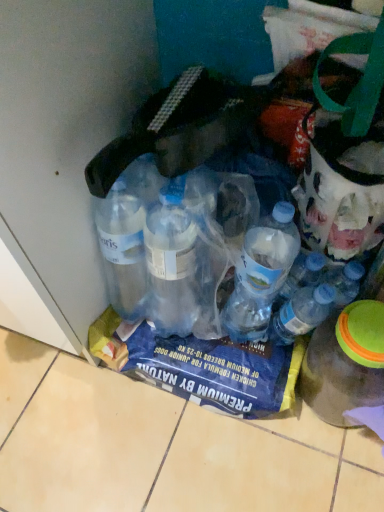
Question: Which direction should I rotate to look at translucent plastic bottle at center, placed as the 2th bottle when sorted from left to right, — up or down?

Choices:
 (A) up
 (B) down

Answer: (B)

Question: Is transparent plastic bottle at lower right, which is the 1th bottle from right to left, thinner than translucent plastic bottle at center, which is counted as the second bottle, starting from the right?

Choices:
 (A) yes
 (B) no

Answer: (B)

Question: From a real-world perspective, is transparent plastic bottle at lower right, which is the 1th bottle from right to left, over translucent plastic bottle at center, placed as the 2th bottle when sorted from left to right?

Choices:
 (A) no
 (B) yes

Answer: (A)

Question: Is transparent plastic bottle at lower right, arranged as the 3th bottle when viewed from the left, not near translucent plastic bottle at center, placed as the 2th bottle when sorted from left to right?

Choices:
 (A) no
 (B) yes

Answer: (A)

Question: Does transparent plastic bottle at lower right, arranged as the 3th bottle when viewed from the left, have a greater height compared to translucent plastic bottle at center, placed as the 2th bottle when sorted from left to right?

Choices:
 (A) no
 (B) yes

Answer: (B)

Question: From the image's perspective, does transparent plastic bottle at lower right, arranged as the 3th bottle when viewed from the left, appear higher than translucent plastic bottle at center, which is counted as the second bottle, starting from the right?

Choices:
 (A) no
 (B) yes

Answer: (A)

Question: From a real-world perspective, does transparent plastic bottle at lower right, arranged as the 3th bottle when viewed from the left, sit lower than translucent plastic bottle at center, which is counted as the second bottle, starting from the right?

Choices:
 (A) yes
 (B) no

Answer: (A)

Question: From a real-world perspective, is transparent plastic bottles at lower left, the third bottle positioned from the right, located higher than translucent plastic bottle at center, placed as the 2th bottle when sorted from left to right?

Choices:
 (A) no
 (B) yes

Answer: (B)

Question: Is the depth of transparent plastic bottles at lower left, the 1th bottle when ordered from left to right, less than that of translucent plastic bottle at center, which is counted as the second bottle, starting from the right?

Choices:
 (A) no
 (B) yes

Answer: (B)

Question: Can you confirm if transparent plastic bottles at lower left, the 1th bottle when ordered from left to right, is positioned to the left of translucent plastic bottle at center, placed as the 2th bottle when sorted from left to right?

Choices:
 (A) no
 (B) yes

Answer: (B)

Question: Is transparent plastic bottles at lower left, the third bottle positioned from the right, shorter than translucent plastic bottle at center, which is counted as the second bottle, starting from the right?

Choices:
 (A) yes
 (B) no

Answer: (B)

Question: Can you confirm if transparent plastic bottles at lower left, the 1th bottle when ordered from left to right, is thinner than translucent plastic bottle at center, placed as the 2th bottle when sorted from left to right?

Choices:
 (A) no
 (B) yes

Answer: (A)

Question: Is transparent plastic bottles at lower left, the 1th bottle when ordered from left to right, to the right of translucent plastic bottle at center, placed as the 2th bottle when sorted from left to right, from the viewer's perspective?

Choices:
 (A) yes
 (B) no

Answer: (B)

Question: Can you confirm if translucent plastic bottle at center, which is counted as the second bottle, starting from the right, is bigger than transparent plastic bottle at lower right, which is the 1th bottle from right to left?

Choices:
 (A) yes
 (B) no

Answer: (B)